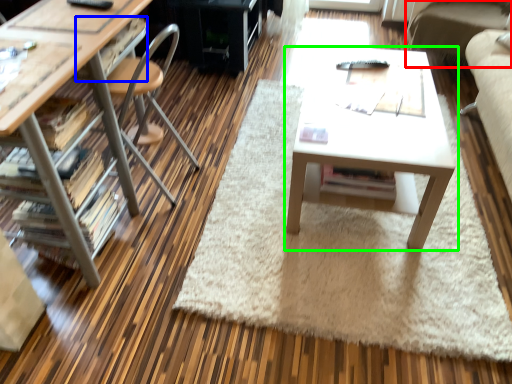
Question: Estimate the real-world distances between objects in this image. Which object is closer to couch (highlighted by a red box), drawer (highlighted by a blue box) or table (highlighted by a green box)?

Choices:
 (A) drawer
 (B) table

Answer: (B)